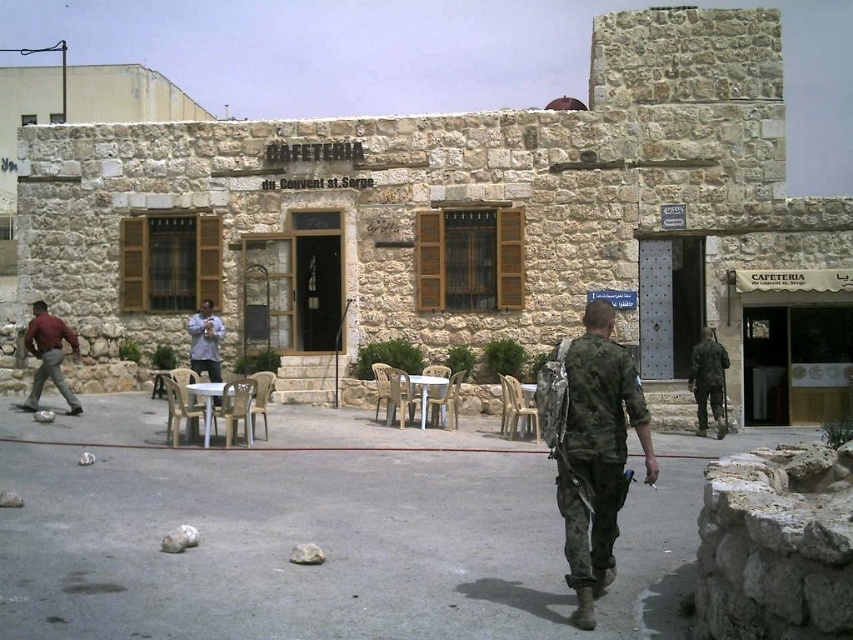
Question: Considering the real-world distances, which object is closest to the light brown wooden chair at center?

Choices:
 (A) camouflage fabric uniform at center
 (B) matte red shirt at left

Answer: (B)

Question: Which of the following is the farthest from the observer?

Choices:
 (A) camouflage uniform at center
 (B) matte red shirt at left
 (C) light brown wooden chair at center

Answer: (C)

Question: Is matte red shirt at left below light brown wooden chair at center?

Choices:
 (A) yes
 (B) no

Answer: (A)

Question: Can you confirm if camouflage uniform at center is bigger than light brown wooden chair at center?

Choices:
 (A) no
 (B) yes

Answer: (B)

Question: Which of the following is the closest to the observer?

Choices:
 (A) matte red shirt at left
 (B) light brown wooden chair at center

Answer: (A)

Question: Does camouflage uniform at center have a smaller size compared to matte red shirt at left?

Choices:
 (A) yes
 (B) no

Answer: (A)